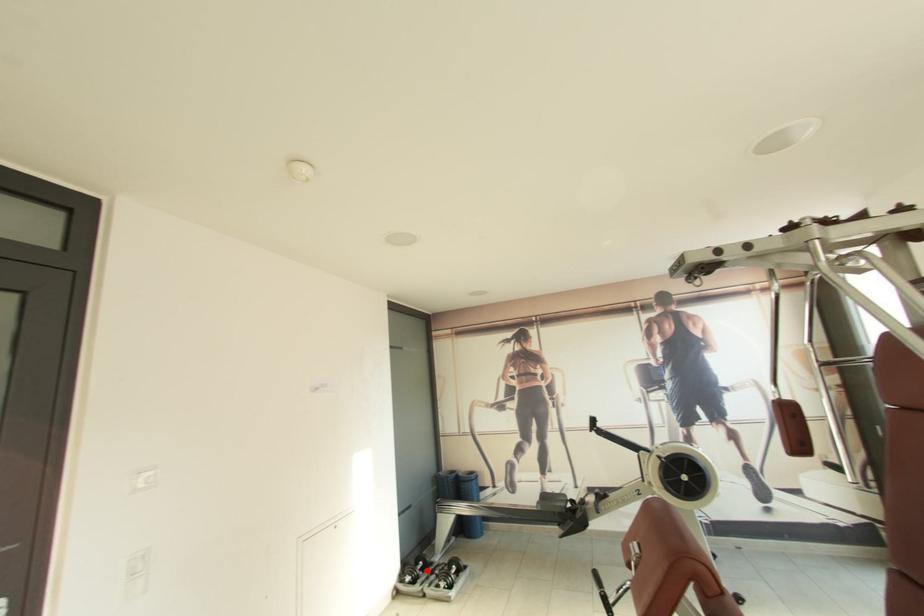
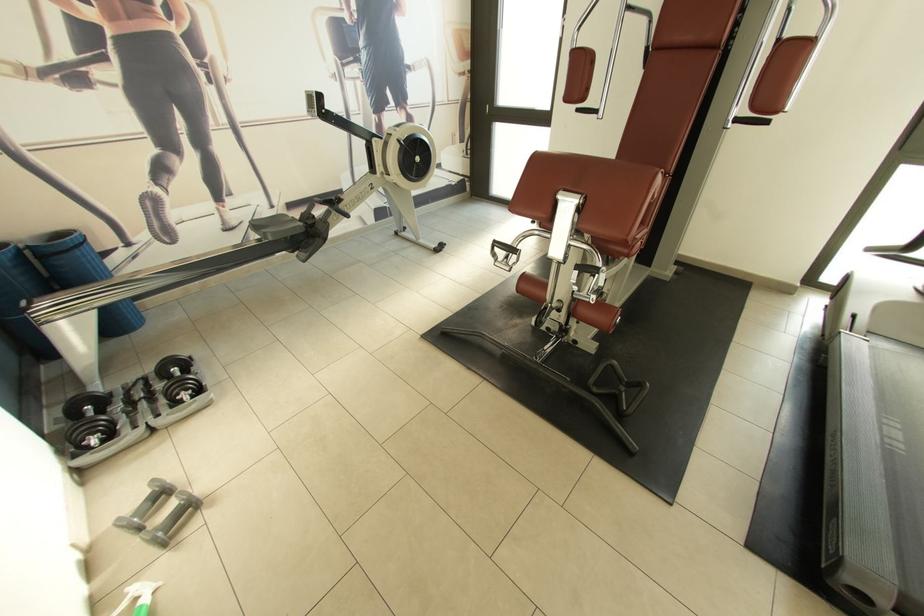
Find the pixel in the second image that matches the highlighted location in the first image.

(106, 413)